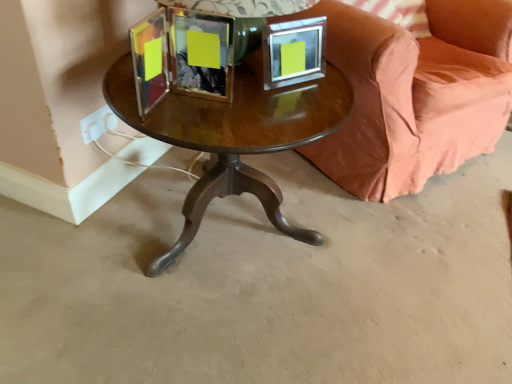
The height and width of the screenshot is (384, 512). In order to click on free spot in front of shiny brown wood coffee table at center in this screenshot , I will do `click(187, 335)`.